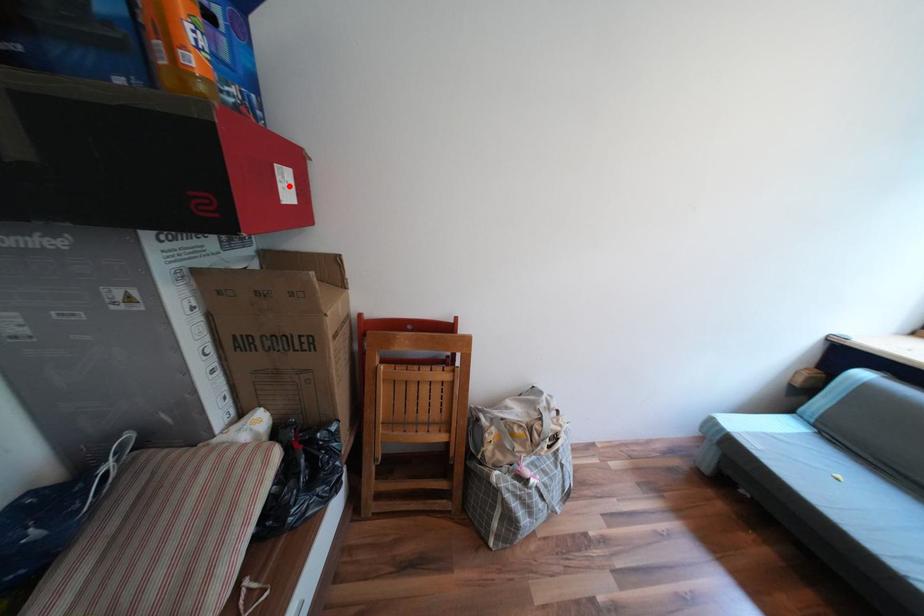
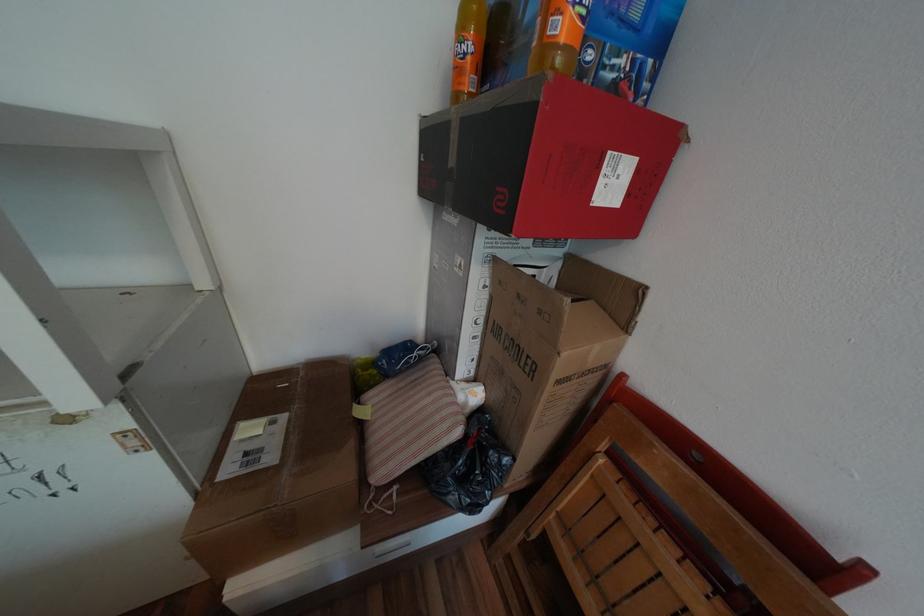
Locate, in the second image, the point that corresponds to the highlighted location in the first image.

(611, 182)